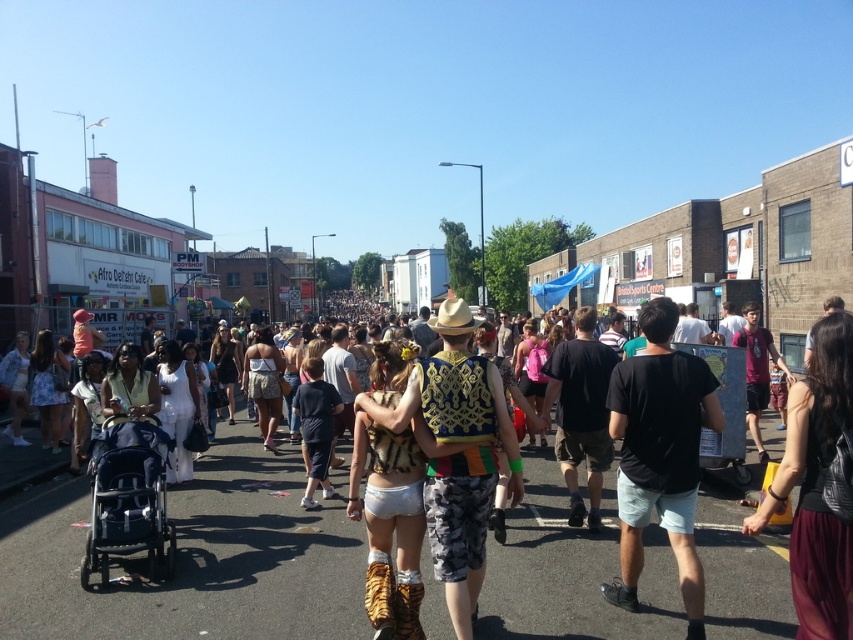
Can you confirm if black leather purse at lower right is shorter than dark gray fabric baby carriage at lower left?

No.

Does black leather purse at lower right appear on the right side of dark gray fabric baby carriage at lower left?

Yes, black leather purse at lower right is to the right of dark gray fabric baby carriage at lower left.

The width and height of the screenshot is (853, 640). In order to click on black leather purse at lower right in this screenshot , I will do `click(816, 484)`.

Can you confirm if black leather purse at lower right is positioned to the right of beige straw cowboy hat at center?

Correct, you'll find black leather purse at lower right to the right of beige straw cowboy hat at center.

Based on the photo, does black leather purse at lower right have a lesser width compared to beige straw cowboy hat at center?

Correct, black leather purse at lower right's width is less than beige straw cowboy hat at center's.

You are a GUI agent. You are given a task and a screenshot of the screen. Output one action in this format:
    pyautogui.click(x=<x>, y=<y>)
    Task: Click on the black leather purse at lower right
    Image resolution: width=853 pixels, height=640 pixels.
    Given the screenshot: What is the action you would take?
    pyautogui.click(x=816, y=484)

Who is more forward, [701,376] or [115,512]?

Positioned in front is point [701,376].

You are a GUI agent. You are given a task and a screenshot of the screen. Output one action in this format:
    pyautogui.click(x=<x>, y=<y>)
    Task: Click on the black matte t-shirt at center
    The width and height of the screenshot is (853, 640).
    Given the screenshot: What is the action you would take?
    pyautogui.click(x=660, y=454)